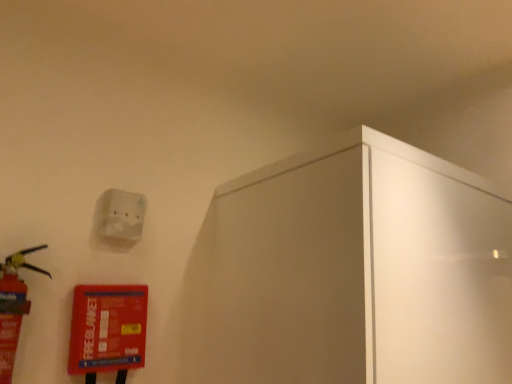
Question: From the image's perspective, is white matte light switch at upper left located beneath red plastic extinguisher at left?

Choices:
 (A) no
 (B) yes

Answer: (A)

Question: Can you confirm if white matte light switch at upper left is wider than red plastic extinguisher at left?

Choices:
 (A) no
 (B) yes

Answer: (A)

Question: Is white matte light switch at upper left oriented towards red plastic extinguisher at left?

Choices:
 (A) no
 (B) yes

Answer: (A)

Question: Is white matte light switch at upper left at the left side of red plastic extinguisher at left?

Choices:
 (A) yes
 (B) no

Answer: (B)

Question: Considering the relative positions of white matte light switch at upper left and red plastic extinguisher at left in the image provided, is white matte light switch at upper left to the right of red plastic extinguisher at left from the viewer's perspective?

Choices:
 (A) no
 (B) yes

Answer: (B)

Question: Does white matte light switch at upper left contain red plastic extinguisher at left?

Choices:
 (A) yes
 (B) no

Answer: (B)

Question: Is red plastic extinguisher at left aimed at white matte light switch at upper left?

Choices:
 (A) yes
 (B) no

Answer: (B)

Question: From the image's perspective, would you say red plastic extinguisher at left is positioned over white matte light switch at upper left?

Choices:
 (A) no
 (B) yes

Answer: (A)

Question: Is the position of red plastic extinguisher at left more distant than that of white matte light switch at upper left?

Choices:
 (A) no
 (B) yes

Answer: (A)

Question: Can white matte light switch at upper left be found inside red plastic extinguisher at left?

Choices:
 (A) no
 (B) yes

Answer: (A)

Question: Is red plastic extinguisher at left to the right of white matte light switch at upper left from the viewer's perspective?

Choices:
 (A) yes
 (B) no

Answer: (B)

Question: Does red plastic extinguisher at left have a lesser height compared to white matte light switch at upper left?

Choices:
 (A) yes
 (B) no

Answer: (B)

Question: Based on their positions, is white matte light switch at upper left located to the left or right of red plastic extinguisher at left?

Choices:
 (A) right
 (B) left

Answer: (A)